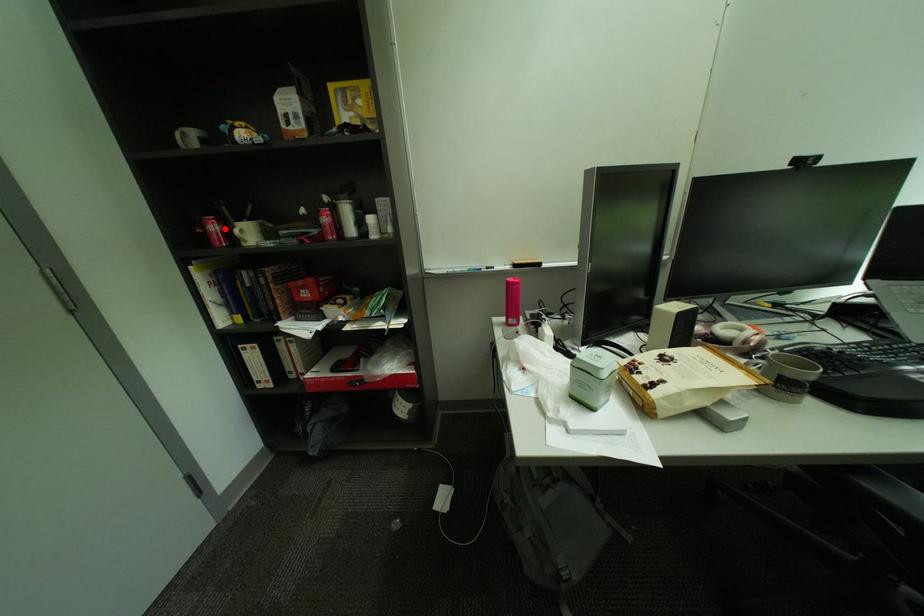
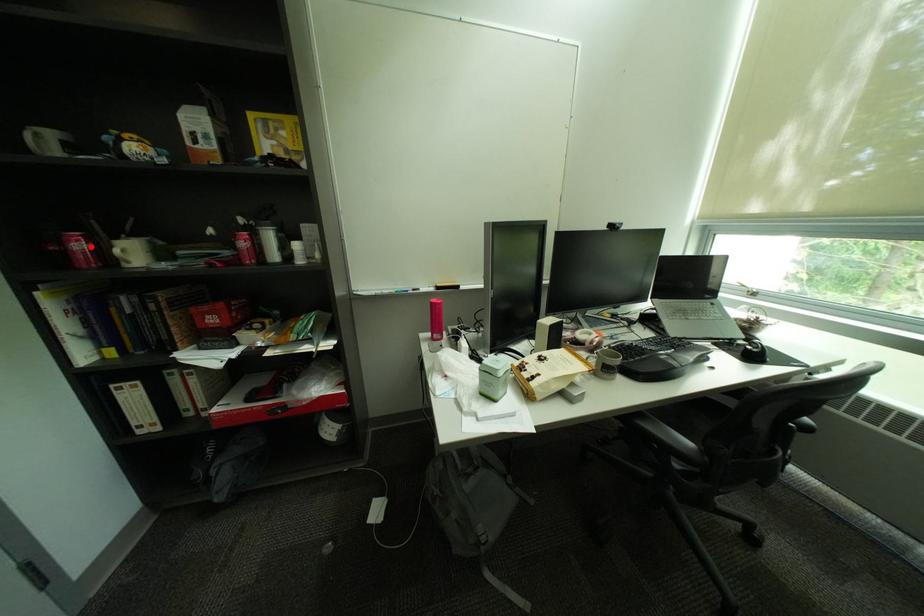
I am providing you with two images of the same scene from different viewpoints. A red point is marked on the first image and another point is marked on the second image. Does the point marked in image1 correspond to the same location as the one in image2?

Yes